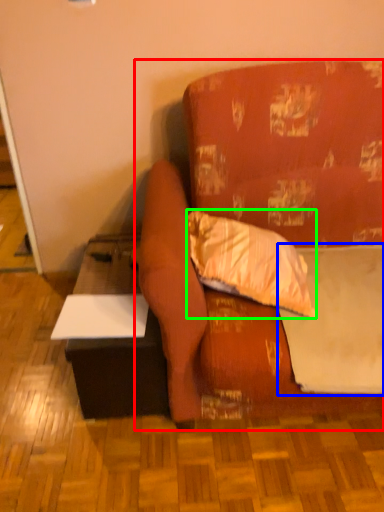
Question: Based on their relative distances, which object is farther from studio couch (highlighted by a red box)? Choose from sheet (highlighted by a blue box) and pillow (highlighted by a green box).

Choices:
 (A) sheet
 (B) pillow

Answer: (A)